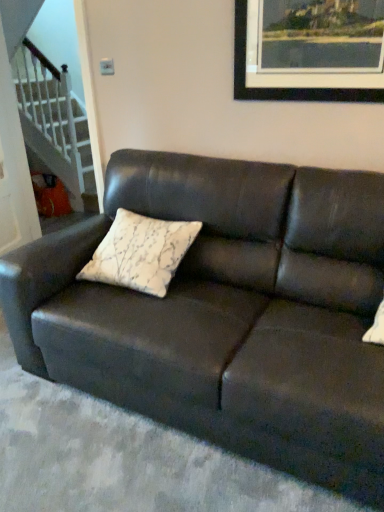
In order to face white glossy staircase at lower left, should I rotate leftwards or rightwards?

Answer: Turn left by 18.960 degrees to look at white glossy staircase at lower left.

Identify the location of white textured pillow at center. (140, 253).

I want to click on matte black couch at center, so pos(227,313).

Identify the location of pillow lying on the left of matte black couch at center. (140, 253).

Can you confirm if white textured pillow at center is shorter than matte black couch at center?

Yes.

What's the angular difference between white textured pillow at center and matte black couch at center's facing directions?

The angular difference between white textured pillow at center and matte black couch at center is 1.11 degrees.

From the picture: Considering their positions, is white glossy staircase at lower left located in front of or behind wooden picture frame at upper center?

white glossy staircase at lower left is behind wooden picture frame at upper center.

Based on the photo, is white glossy staircase at lower left bigger than wooden picture frame at upper center?

Correct, white glossy staircase at lower left is larger in size than wooden picture frame at upper center.

Is white glossy staircase at lower left aimed at wooden picture frame at upper center?

No, white glossy staircase at lower left is not oriented towards wooden picture frame at upper center.

In terms of size, does matte black couch at center appear bigger or smaller than white textured pillow at center?

Clearly, matte black couch at center is larger in size than white textured pillow at center.

What's the angular difference between matte black couch at center and white textured pillow at center's facing directions?

1.11 degrees separate the facing orientations of matte black couch at center and white textured pillow at center.

Between point (313, 388) and point (141, 238), which one is positioned in front?

The point (313, 388) is more forward.

Is matte black couch at center behind white textured pillow at center?

No, it is not.

Visually, is wooden picture frame at upper center positioned to the left or to the right of white glossy staircase at lower left?

In the image, wooden picture frame at upper center appears on the right side of white glossy staircase at lower left.

Who is shorter, wooden picture frame at upper center or white glossy staircase at lower left?

wooden picture frame at upper center.

Do you think wooden picture frame at upper center is within white glossy staircase at lower left, or outside of it?

wooden picture frame at upper center is spatially situated outside white glossy staircase at lower left.

From a real-world perspective, is wooden picture frame at upper center positioned under white glossy staircase at lower left based on gravity?

No, from a real-world perspective, wooden picture frame at upper center is not below white glossy staircase at lower left.

Can you confirm if white glossy staircase at lower left is taller than white textured pillow at center?

Correct, white glossy staircase at lower left is much taller as white textured pillow at center.

Is white glossy staircase at lower left wider or thinner than white textured pillow at center?

white glossy staircase at lower left is thinner than white textured pillow at center.

Which object is positioned more to the left, white glossy staircase at lower left or white textured pillow at center?

white glossy staircase at lower left is more to the left.

Considering their positions, is white glossy staircase at lower left located in front of or behind white textured pillow at center?

white glossy staircase at lower left is positioned farther from the viewer than white textured pillow at center.

From the image's perspective, between white textured pillow at center and wooden picture frame at upper center, which one is located above?

wooden picture frame at upper center is shown above in the image.

Is white textured pillow at center not close to wooden picture frame at upper center?

No, white textured pillow at center is in close proximity to wooden picture frame at upper center.

Is white textured pillow at center turned away from wooden picture frame at upper center?

No.

Considering the positions of points (157, 231) and (239, 32), is point (157, 231) closer to camera compared to point (239, 32)?

No, it is not.

In terms of size, does white glossy staircase at lower left appear bigger or smaller than matte black couch at center?

In the image, white glossy staircase at lower left appears to be smaller than matte black couch at center.

Visually, is white glossy staircase at lower left positioned to the left or to the right of matte black couch at center?

From the image, it's evident that white glossy staircase at lower left is to the left of matte black couch at center.

What's the angular difference between white glossy staircase at lower left and matte black couch at center's facing directions?

white glossy staircase at lower left and matte black couch at center are facing 1.5 degrees away from each other.

From a real-world perspective, which object stands above the other?

In real-world perspective, white glossy staircase at lower left is above.

Find the location of `studio couch in front of the white textured pillow at center`. studio couch in front of the white textured pillow at center is located at coordinates tap(227, 313).

Where is `stairwell behind the wooden picture frame at upper center`? This screenshot has width=384, height=512. stairwell behind the wooden picture frame at upper center is located at coordinates (57, 133).

From the image, which object appears to be farther from matte black couch at center, wooden picture frame at upper center or white textured pillow at center?

Among the two, wooden picture frame at upper center is located further to matte black couch at center.

Based on the photo, looking at the image, which one is located closer to white textured pillow at center, matte black couch at center or wooden picture frame at upper center?

Based on the image, matte black couch at center appears to be nearer to white textured pillow at center.

Based on their spatial positions, is white textured pillow at center or white glossy staircase at lower left closer to matte black couch at center?

white textured pillow at center.

In the scene shown: From the image, which object appears to be farther from wooden picture frame at upper center, white textured pillow at center or matte black couch at center?

matte black couch at center lies further to wooden picture frame at upper center than the other object.

From the picture: Considering their positions, is wooden picture frame at upper center positioned closer to white glossy staircase at lower left than matte black couch at center?

matte black couch at center lies closer to white glossy staircase at lower left than the other object.

Consider the image. Looking at the image, which one is located further to wooden picture frame at upper center, white glossy staircase at lower left or matte black couch at center?

white glossy staircase at lower left.

Which object lies nearer to the anchor point white textured pillow at center, white glossy staircase at lower left or matte black couch at center?

The object closer to white textured pillow at center is matte black couch at center.

Which object lies nearer to the anchor point wooden picture frame at upper center, white glossy staircase at lower left or white textured pillow at center?

Among the two, white textured pillow at center is located nearer to wooden picture frame at upper center.

Locate an element on the screen. The height and width of the screenshot is (512, 384). pillow between wooden picture frame at upper center and white glossy staircase at lower left along the z-axis is located at coordinates (140, 253).

Where is `picture frame between matte black couch at center and white glossy staircase at lower left along the z-axis`? This screenshot has height=512, width=384. picture frame between matte black couch at center and white glossy staircase at lower left along the z-axis is located at coordinates (285, 87).

The image size is (384, 512). Find the location of `pillow between matte black couch at center and white glossy staircase at lower left from front to back`. pillow between matte black couch at center and white glossy staircase at lower left from front to back is located at coordinates (140, 253).

Identify the location of pillow between wooden picture frame at upper center and matte black couch at center vertically. The height and width of the screenshot is (512, 384). (140, 253).